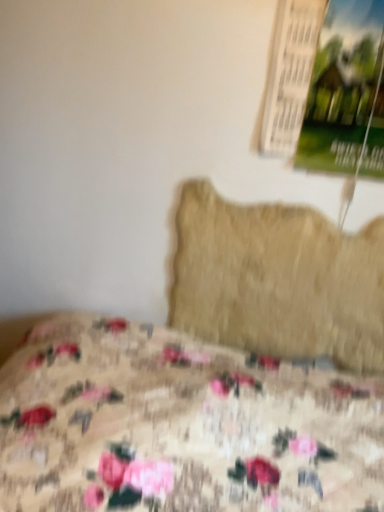
Image resolution: width=384 pixels, height=512 pixels. What do you see at coordinates (342, 86) in the screenshot?
I see `green paper poster at upper right` at bounding box center [342, 86].

Where is `floral fabric bed at lower left`? This screenshot has height=512, width=384. floral fabric bed at lower left is located at coordinates (212, 378).

Find the location of a particular element. green paper poster at upper right is located at coordinates (342, 86).

Which is behind, beige fuzzy pillow at center or floral fabric bed at lower left?

beige fuzzy pillow at center is further away from the camera.

From the image's perspective, is beige fuzzy pillow at center positioned above or below floral fabric bed at lower left?

beige fuzzy pillow at center is situated higher than floral fabric bed at lower left in the image.

Between beige fuzzy pillow at center and floral fabric bed at lower left, which one has larger size?

With larger size is floral fabric bed at lower left.

From a real-world perspective, between beige fuzzy pillow at center and floral fabric bed at lower left, who is vertically higher?

beige fuzzy pillow at center.

Is green paper poster at upper right facing towards floral fabric bed at lower left?

No, green paper poster at upper right is not aimed at floral fabric bed at lower left.

Between green paper poster at upper right and floral fabric bed at lower left, which one appears on the left side from the viewer's perspective?

floral fabric bed at lower left.

Considering the relative sizes of green paper poster at upper right and floral fabric bed at lower left in the image provided, is green paper poster at upper right wider than floral fabric bed at lower left?

Incorrect, the width of green paper poster at upper right does not surpass that of floral fabric bed at lower left.

Is green paper poster at upper right not inside floral fabric bed at lower left?

Answer: Absolutely, green paper poster at upper right is external to floral fabric bed at lower left.

How many degrees apart are the facing directions of beige fuzzy pillow at center and green paper poster at upper right?

Answer: There is a 0.0341-degree angle between the facing directions of beige fuzzy pillow at center and green paper poster at upper right.

Considering the relative sizes of beige fuzzy pillow at center and green paper poster at upper right in the image provided, is beige fuzzy pillow at center taller than green paper poster at upper right?

Correct, beige fuzzy pillow at center is much taller as green paper poster at upper right.

Does beige fuzzy pillow at center lie behind green paper poster at upper right?

Yes, the depth of beige fuzzy pillow at center is greater than that of green paper poster at upper right.

How much distance is there between floral fabric bed at lower left and green paper poster at upper right?

floral fabric bed at lower left and green paper poster at upper right are 99.47 centimeters apart from each other.

Considering the sizes of objects floral fabric bed at lower left and green paper poster at upper right in the image provided, who is thinner, floral fabric bed at lower left or green paper poster at upper right?

green paper poster at upper right is thinner.

From a real-world perspective, relative to green paper poster at upper right, is floral fabric bed at lower left vertically above or below?

floral fabric bed at lower left is situated lower than green paper poster at upper right in the real world.

Is floral fabric bed at lower left positioned beyond the bounds of green paper poster at upper right?

floral fabric bed at lower left lies outside green paper poster at upper right's area.

Considering the sizes of green paper poster at upper right and beige fuzzy pillow at center in the image, is green paper poster at upper right taller or shorter than beige fuzzy pillow at center?

Clearly, green paper poster at upper right is shorter compared to beige fuzzy pillow at center.

Is green paper poster at upper right thinner than beige fuzzy pillow at center?

Incorrect, the width of green paper poster at upper right is not less than that of beige fuzzy pillow at center.

Is green paper poster at upper right far away from beige fuzzy pillow at center?

No, there isn't a large distance between green paper poster at upper right and beige fuzzy pillow at center.

How many degrees apart are the facing directions of green paper poster at upper right and beige fuzzy pillow at center?

The facing directions of green paper poster at upper right and beige fuzzy pillow at center are 0.0341 degrees apart.

Is floral fabric bed at lower left in contact with beige fuzzy pillow at center?

No, floral fabric bed at lower left is not making contact with beige fuzzy pillow at center.

Does floral fabric bed at lower left turn towards beige fuzzy pillow at center?

No, floral fabric bed at lower left does not turn towards beige fuzzy pillow at center.

Is floral fabric bed at lower left outside of beige fuzzy pillow at center?

Yes, floral fabric bed at lower left is not within beige fuzzy pillow at center.

Identify the location of bed below the beige fuzzy pillow at center (from the image's perspective). This screenshot has height=512, width=384. (212, 378).

You are a GUI agent. You are given a task and a screenshot of the screen. Output one action in this format:
    pyautogui.click(x=<x>, y=<y>)
    Task: Click on the pillow on the right of floral fabric bed at lower left
    
    Given the screenshot: What is the action you would take?
    pyautogui.click(x=277, y=280)

The width and height of the screenshot is (384, 512). Identify the location of poster page that appears above the floral fabric bed at lower left (from the image's perspective). (342, 86).

Estimate the real-world distances between objects in this image. Which object is closer to floral fabric bed at lower left, green paper poster at upper right or beige fuzzy pillow at center?

beige fuzzy pillow at center is positioned closer to the anchor floral fabric bed at lower left.

Based on their spatial positions, is floral fabric bed at lower left or green paper poster at upper right further from beige fuzzy pillow at center?

floral fabric bed at lower left lies further to beige fuzzy pillow at center than the other object.

Estimate the real-world distances between objects in this image. Which object is further from green paper poster at upper right, beige fuzzy pillow at center or floral fabric bed at lower left?

Based on the image, floral fabric bed at lower left appears to be further to green paper poster at upper right.

Looking at the image, which one is located closer to floral fabric bed at lower left, beige fuzzy pillow at center or green paper poster at upper right?

beige fuzzy pillow at center.

From the image, which object appears to be nearer to beige fuzzy pillow at center, green paper poster at upper right or floral fabric bed at lower left?

green paper poster at upper right is closer to beige fuzzy pillow at center.

Estimate the real-world distances between objects in this image. Which object is further from green paper poster at upper right, floral fabric bed at lower left or beige fuzzy pillow at center?

floral fabric bed at lower left.

The image size is (384, 512). I want to click on pillow between green paper poster at upper right and floral fabric bed at lower left from top to bottom, so click(x=277, y=280).